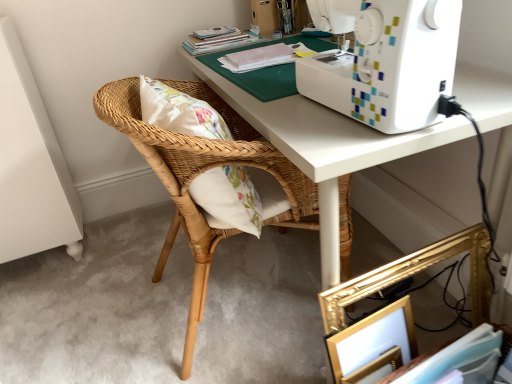
Question: From a real-world perspective, does white paper book at lower right, the 3th book from the back, sit lower than matte white book at upper center, the 2th book positioned from the bottom?

Choices:
 (A) no
 (B) yes

Answer: (B)

Question: Considering the relative sizes of white paper book at lower right, which is the 3th book in left-to-right order, and matte white book at upper center, placed as the second book when sorted from left to right, in the image provided, is white paper book at lower right, which is the 3th book in left-to-right order, bigger than matte white book at upper center, placed as the second book when sorted from left to right,?

Choices:
 (A) yes
 (B) no

Answer: (A)

Question: Is matte white book at upper center, the 2th book positioned from the bottom, at the back of white paper book at lower right, which is the 3th book in left-to-right order?

Choices:
 (A) yes
 (B) no

Answer: (B)

Question: Is white paper book at lower right, placed as the third book when sorted from top to bottom, next to matte white book at upper center, placed as the second book when sorted from left to right?

Choices:
 (A) no
 (B) yes

Answer: (A)

Question: Is white paper book at lower right, which is the 1th book in bottom-to-top order, to the right of matte white book at upper center, placed as the second book when sorted from left to right, from the viewer's perspective?

Choices:
 (A) yes
 (B) no

Answer: (A)

Question: Is white paper book at lower right, the 3th book from the back, not close to matte white book at upper center, the 2th book from the top?

Choices:
 (A) yes
 (B) no

Answer: (B)

Question: Is gold metallic picture frame at lower right positioned far away from white paper book at lower right, the 3th book from the back?

Choices:
 (A) no
 (B) yes

Answer: (A)

Question: Is white paper book at lower right, which is the 3th book in left-to-right order, at the back of gold metallic picture frame at lower right?

Choices:
 (A) no
 (B) yes

Answer: (B)

Question: Considering the relative sizes of gold metallic picture frame at lower right and white paper book at lower right, which is the 3th book in left-to-right order, in the image provided, is gold metallic picture frame at lower right wider than white paper book at lower right, which is the 3th book in left-to-right order,?

Choices:
 (A) no
 (B) yes

Answer: (A)

Question: From a real-world perspective, is gold metallic picture frame at lower right physically above white paper book at lower right, positioned as the first book in right-to-left order?

Choices:
 (A) no
 (B) yes

Answer: (A)

Question: Is gold metallic picture frame at lower right to the left of white paper book at lower right, which is the 3th book in left-to-right order, from the viewer's perspective?

Choices:
 (A) yes
 (B) no

Answer: (A)

Question: Could you tell me if gold metallic picture frame at lower right is facing white paper book at lower right, the 3th book from the back?

Choices:
 (A) yes
 (B) no

Answer: (A)

Question: From a real-world perspective, is woven wood chair at center physically below gold metallic picture frame at lower right?

Choices:
 (A) no
 (B) yes

Answer: (A)